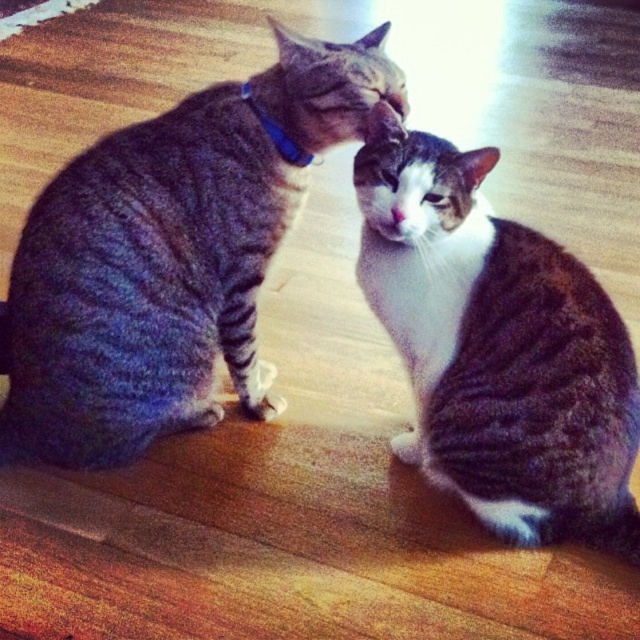
You are a photographer trying to capture a closeup of the gray tabby cat at center. However, you notice the blue fabric neckband at upper center is blocking your view. Can you move the neckband to the side to get a clear shot?

The gray tabby cat at center is below the blue fabric neckband at upper center, so moving the neckband to the side would allow you to get a clear shot of the cat without obstruction.

You are trying to decide which object is wider between the gray tabby cat at center and the blue fabric neckband at upper center. Based on the scene, which one is wider?

The gray tabby cat at center is wider than the blue fabric neckband at upper center according to the description.

You are a photographer setting up a camera to capture both the gray striped cat at left and the white fur at center in the same frame. Given that the camera has a fixed focal length and limited field of view, which cat requires more space in the frame to avoid being cropped out?

The gray striped cat at left requires more space in the frame because its width surpasses that of the white fur at center.